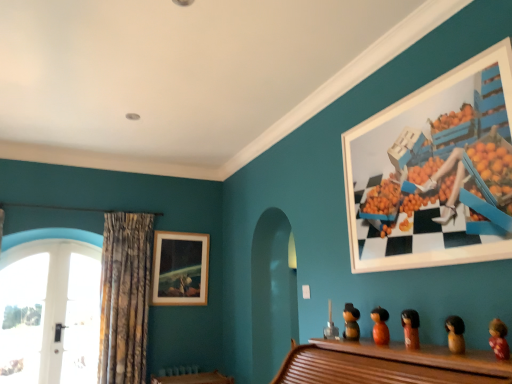
Question: In terms of size, does fluffy pink doll at lower right, which is counted as the 1th toy, starting from the front, appear bigger or smaller than brown wooden figurine at center, which is the third toy from left to right?

Choices:
 (A) big
 (B) small

Answer: (B)

Question: Does point (501, 324) appear closer or farther from the camera than point (406, 339)?

Choices:
 (A) farther
 (B) closer

Answer: (B)

Question: Which object is positioned closest to the white matte picture frame at upper right, acting as the 2th picture frame starting from the back?

Choices:
 (A) brown wooden figurine at center, which is the 3th toy from front to back
 (B) brown wooden doll at lower right, which is the fourth toy in left-to-right order
 (C) orange matte wooden doll at center, which is the fourth toy from right to left
 (D) wooden picture frame at upper center, placed as the 2th picture frame when sorted from right to left
 (E) textured brown curtain at left

Answer: (B)

Question: Which object is positioned farthest from the white matte picture frame at upper right, which ranks as the 1th picture frame in right-to-left order?

Choices:
 (A) brown wooden doll at lower right, which is the fourth toy in left-to-right order
 (B) brown wooden figurine at center, which is the 3th toy from front to back
 (C) textured brown curtain at left
 (D) wooden picture frame at upper center, placed as the 2th picture frame when sorted from right to left
 (E) fluffy pink doll at lower right, which is counted as the 1th toy, starting from the front

Answer: (C)